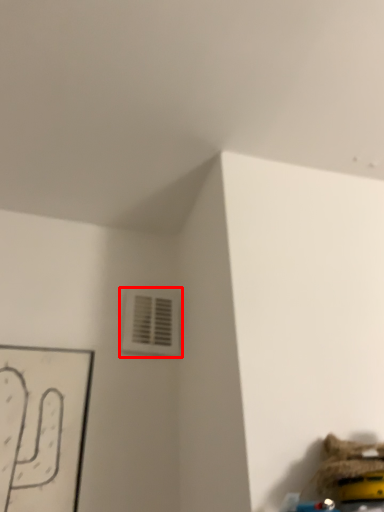
Question: From the image's perspective, what is the correct spatial relationship of air conditioning (annotated by the red box) in relation to toy?

Choices:
 (A) below
 (B) above

Answer: (B)